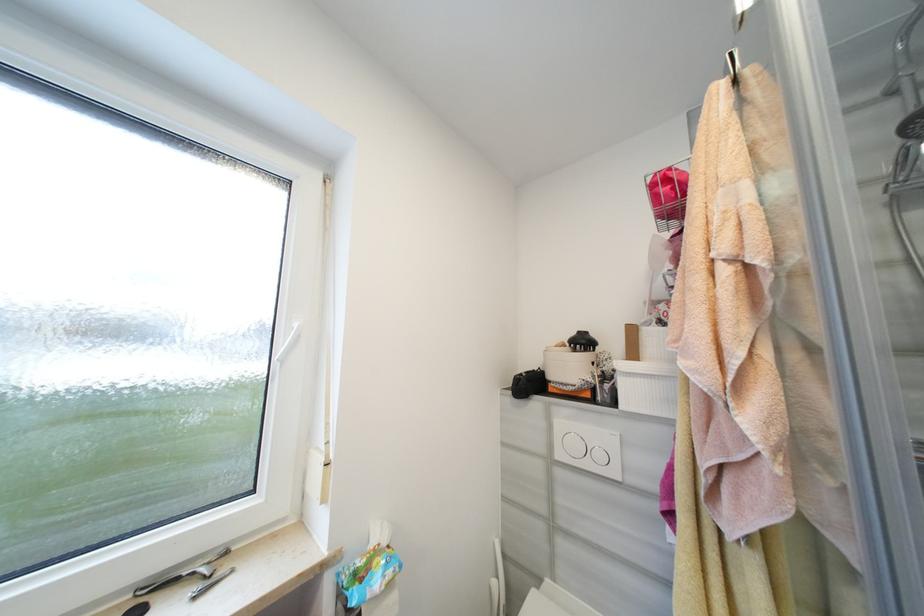
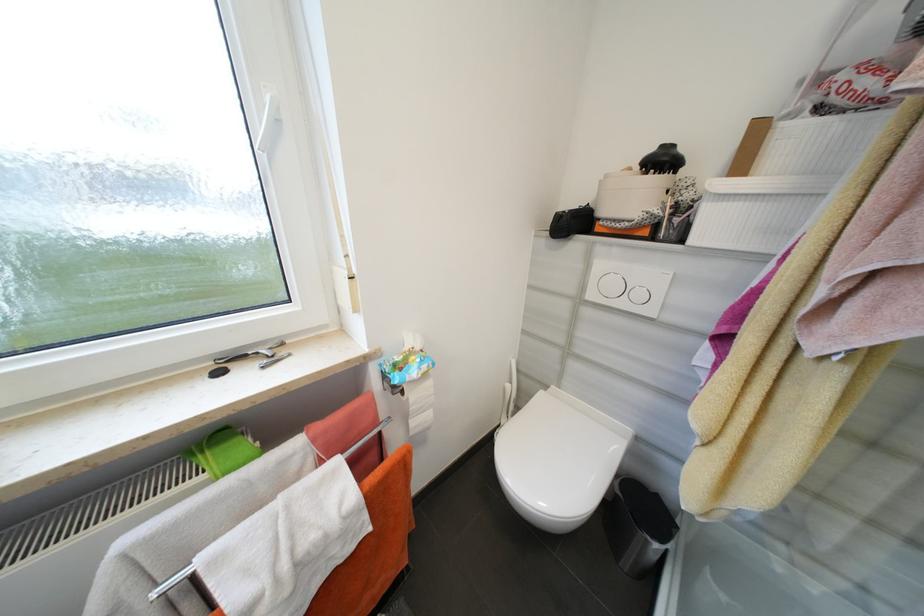
Find the pixel in the second image that matches [596,381] in the first image.

(663, 213)